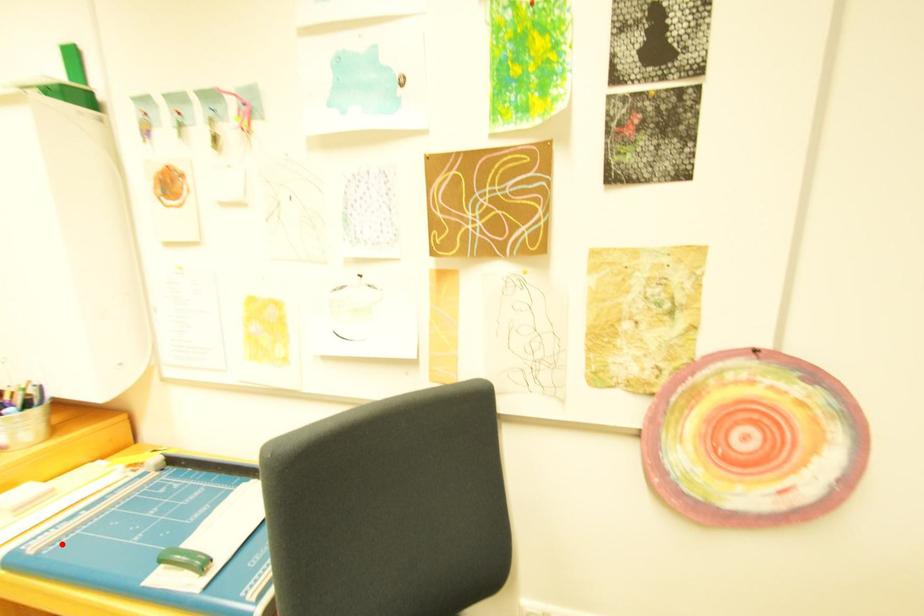
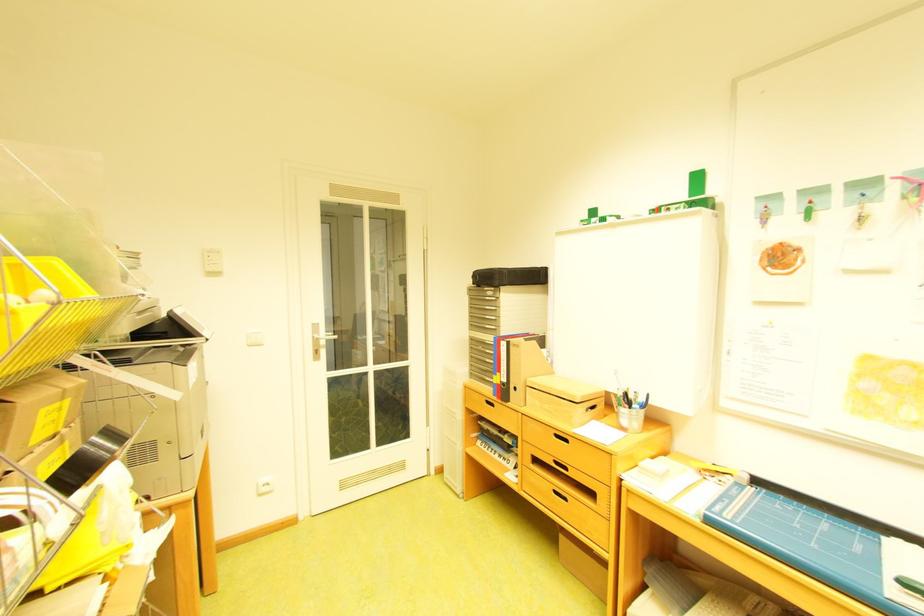
Find the pixel in the second image that matches the highlighted location in the first image.

(747, 517)